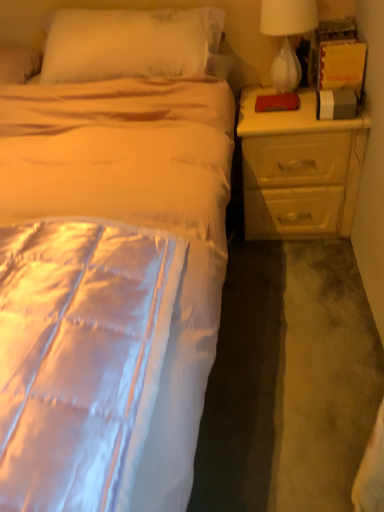
What are the coordinates of `unoccupied area in front of yellow matte nightstand at right` in the screenshot? It's located at (294, 275).